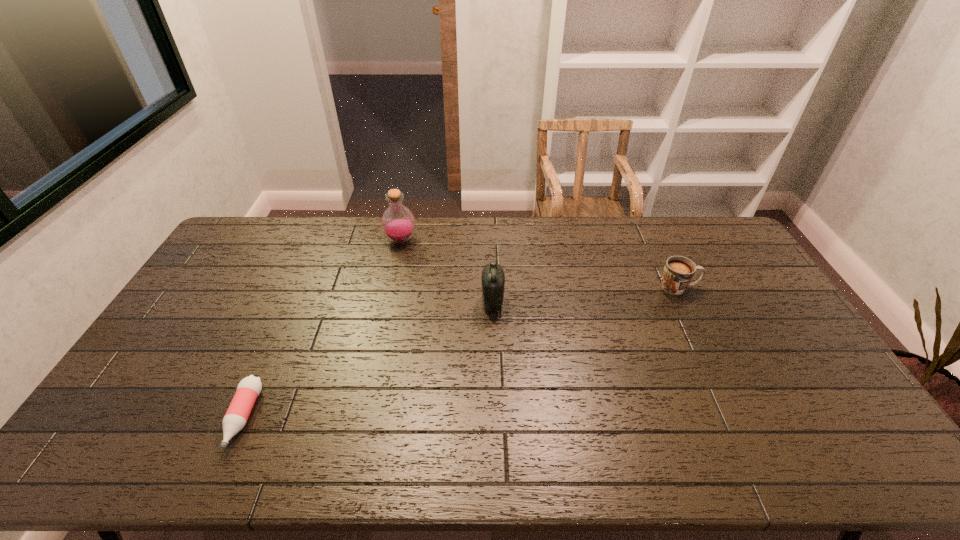
Locate an element on the screen. the farthest object is located at coordinates (398, 223).

I want to click on the third object from right to left, so click(398, 223).

Locate an element on the screen. the second tallest bottle is located at coordinates (493, 278).

Image resolution: width=960 pixels, height=540 pixels. Identify the location of the second farthest bottle. (493, 278).

Find the location of `mug`. mug is located at coordinates (678, 272).

I want to click on the rightmost object, so click(678, 272).

The image size is (960, 540). I want to click on the leftmost object, so click(x=249, y=388).

Image resolution: width=960 pixels, height=540 pixels. What are the coordinates of `the shortest bottle` in the screenshot? It's located at (249, 388).

Locate an element on the screen. vacant space situated 0.330m on the right of the second bottle from right to left is located at coordinates (504, 240).

This screenshot has width=960, height=540. I want to click on vacant area situated 0.080m on the back of the second tallest bottle, so click(x=492, y=276).